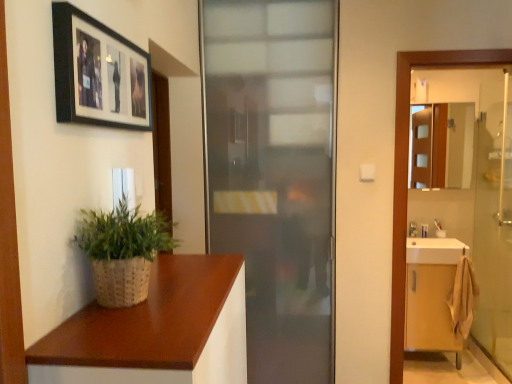
Locate an element on the screen. The height and width of the screenshot is (384, 512). spots to the right of woven natural plant at lower left is located at coordinates (199, 304).